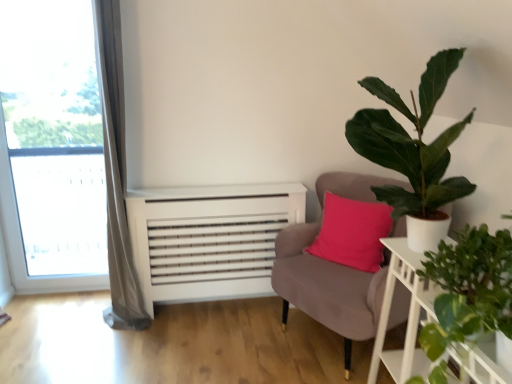
Question: Looking at the image, does green matte plant at upper right, which appears as the 2th houseplant when ordered from the bottom, seem bigger or smaller compared to white wooden table at right?

Choices:
 (A) big
 (B) small

Answer: (A)

Question: Considering the positions of point (432, 77) and point (426, 306), is point (432, 77) closer or farther from the camera than point (426, 306)?

Choices:
 (A) closer
 (B) farther

Answer: (A)

Question: Which object is the farthest from the transparent glass window at left?

Choices:
 (A) green matte plant at upper right, which appears as the 1th houseplant when viewed from the top
 (B) velvet pink chair at center
 (C) white wooden table at right
 (D) green leafy plant at right, positioned as the 2th houseplant in top-to-bottom order

Answer: (D)

Question: Which object is the farthest from the white wooden table at right?

Choices:
 (A) velvet pink chair at center
 (B) transparent glass window at left
 (C) green leafy plant at right, positioned as the 2th houseplant in top-to-bottom order
 (D) green matte plant at upper right, which appears as the 1th houseplant when viewed from the top

Answer: (B)